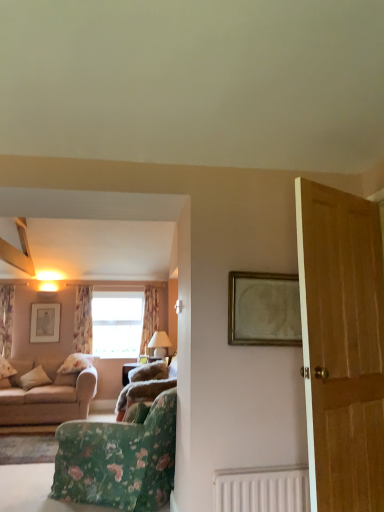
Question: Can you confirm if matte silver picture frame at upper left, which is the 2th picture frame in top-to-bottom order, is wider than white matte radiator at lower center?

Choices:
 (A) no
 (B) yes

Answer: (A)

Question: From the image's perspective, does matte silver picture frame at upper left, acting as the first picture frame starting from the bottom, appear lower than white matte radiator at lower center?

Choices:
 (A) yes
 (B) no

Answer: (B)

Question: Considering the relative sizes of matte silver picture frame at upper left, arranged as the 2th picture frame when viewed from the front, and white matte radiator at lower center in the image provided, is matte silver picture frame at upper left, arranged as the 2th picture frame when viewed from the front, shorter than white matte radiator at lower center?

Choices:
 (A) no
 (B) yes

Answer: (A)

Question: Would you say matte silver picture frame at upper left, which is the first picture frame from back to front, is outside white matte radiator at lower center?

Choices:
 (A) no
 (B) yes

Answer: (B)

Question: Is matte silver picture frame at upper left, placed as the 1th picture frame when sorted from left to right, looking in the opposite direction of white matte radiator at lower center?

Choices:
 (A) yes
 (B) no

Answer: (B)

Question: In terms of height, does floral fabric curtain at left, marked as the third curtain in a right-to-left arrangement, look taller or shorter compared to matte white lampshade at center?

Choices:
 (A) short
 (B) tall

Answer: (B)

Question: From the image's perspective, relative to matte white lampshade at center, is floral fabric curtain at left, marked as the third curtain in a right-to-left arrangement, above or below?

Choices:
 (A) above
 (B) below

Answer: (A)

Question: In the image, is floral fabric curtain at left, marked as the third curtain in a right-to-left arrangement, positioned in front of or behind matte white lampshade at center?

Choices:
 (A) behind
 (B) front

Answer: (B)

Question: Is floral fabric curtain at left, the first curtain viewed from the left, bigger or smaller than matte white lampshade at center?

Choices:
 (A) big
 (B) small

Answer: (B)

Question: Is point (1, 294) positioned closer to the camera than point (167, 459)?

Choices:
 (A) farther
 (B) closer

Answer: (A)

Question: Is floral fabric curtain at left, marked as the third curtain in a right-to-left arrangement, bigger or smaller than floral fabric chair at lower left?

Choices:
 (A) big
 (B) small

Answer: (B)

Question: From a real-world perspective, is floral fabric curtain at left, marked as the third curtain in a right-to-left arrangement, above or below floral fabric chair at lower left?

Choices:
 (A) above
 (B) below

Answer: (A)

Question: Would you say floral fabric curtain at left, marked as the third curtain in a right-to-left arrangement, is inside or outside floral fabric chair at lower left?

Choices:
 (A) outside
 (B) inside

Answer: (A)

Question: Relative to floral fabric curtain at left, the second curtain when ordered from left to right, is matte white lampshade at center in front or behind?

Choices:
 (A) behind
 (B) front

Answer: (B)

Question: Is point (167, 334) closer or farther from the camera than point (84, 317)?

Choices:
 (A) closer
 (B) farther

Answer: (A)